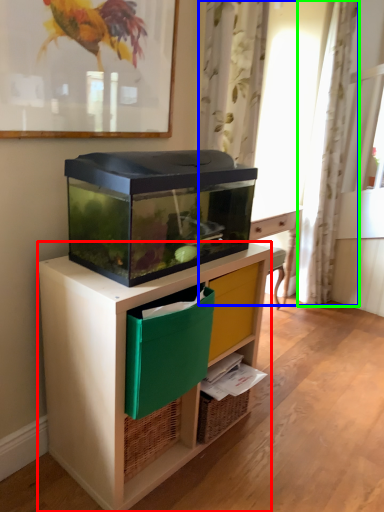
Question: Considering the real-world distances, which object is closest to desk (highlighted by a red box)? curtain (highlighted by a blue box) or curtain (highlighted by a green box).

Choices:
 (A) curtain
 (B) curtain

Answer: (B)